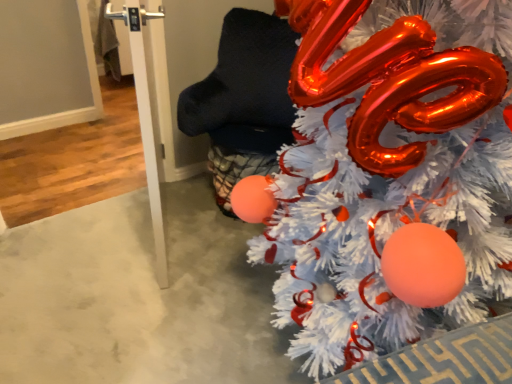
Locate an element on the screen. The width and height of the screenshot is (512, 384). free spot below white glossy door handle at left (from a real-world perspective) is located at coordinates (150, 230).